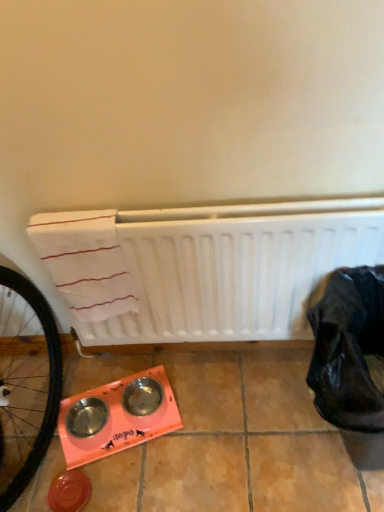
You are a GUI agent. You are given a task and a screenshot of the screen. Output one action in this format:
    pyautogui.click(x=<x>, y=<y>)
    Task: Click on the free spot above white matte radiator at center (from a real-world perspective)
    The width and height of the screenshot is (384, 512).
    Given the screenshot: What is the action you would take?
    tap(194, 211)